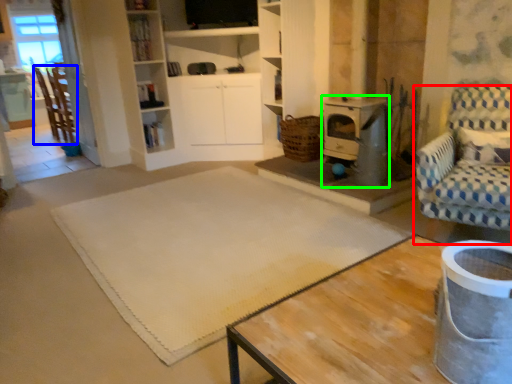
Question: Which object is the farthest from chair (highlighted by a red box)? Choose among these: chair (highlighted by a blue box) or appliance (highlighted by a green box).

Choices:
 (A) chair
 (B) appliance

Answer: (A)